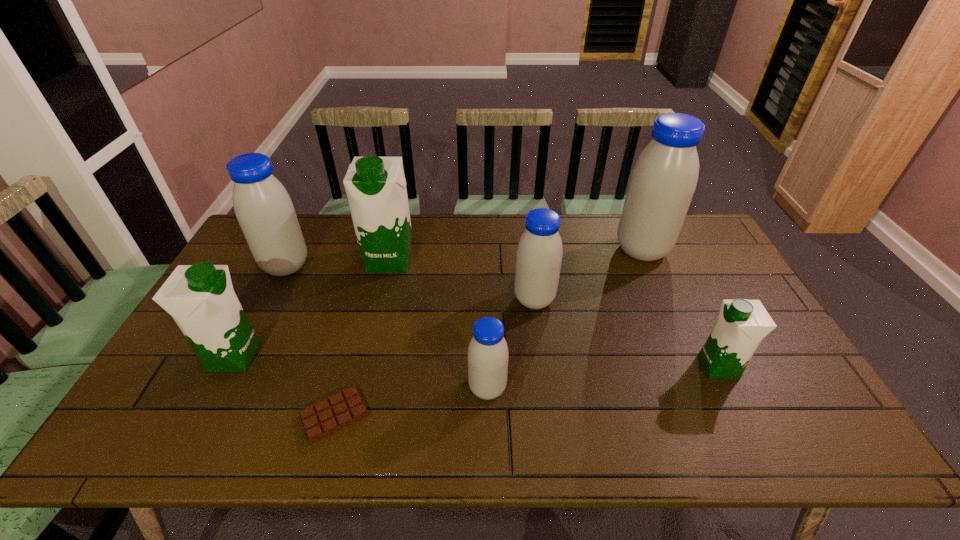
Choose which soya milk is the second nearest neighbor to the second green soya milk from left to right. Please provide its 2D coordinates. Your answer should be formatted as a tuple, i.e. [(x, y)], where the tuple contains the x and y coordinates of a point satisfying the conditions above.

[(200, 298)]

Select which soya milk appears as the third closest to the shortest object. Please provide its 2D coordinates. Your answer should be formatted as a tuple, i.e. [(x, y)], where the tuple contains the x and y coordinates of a point satisfying the conditions above.

[(263, 207)]

Locate which blue soya milk ranks third in proximity to the rightmost blue soya milk. Please provide its 2D coordinates. Your answer should be formatted as a tuple, i.e. [(x, y)], where the tuple contains the x and y coordinates of a point satisfying the conditions above.

[(263, 207)]

Select which blue soya milk is the third closest to the second smallest green soya milk. Please provide its 2D coordinates. Your answer should be formatted as a tuple, i.e. [(x, y)], where the tuple contains the x and y coordinates of a point satisfying the conditions above.

[(539, 254)]

Identify which green soya milk is the second closest to the fifth object from left to right. Please provide its 2D coordinates. Your answer should be formatted as a tuple, i.e. [(x, y)], where the tuple contains the x and y coordinates of a point satisfying the conditions above.

[(742, 324)]

Select which green soya milk appears as the closest to the rightmost green soya milk. Please provide its 2D coordinates. Your answer should be formatted as a tuple, i.e. [(x, y)], where the tuple contains the x and y coordinates of a point satisfying the conditions above.

[(375, 186)]

This screenshot has height=540, width=960. Identify the location of vacant point that satisfies the following two spatial constraints: 1. on the front-facing side of the second smallest blue soya milk; 2. on the right side of the farthest green soya milk. (380, 299).

This screenshot has width=960, height=540. What are the coordinates of `vacant position in the image that satisfies the following two spatial constraints: 1. on the front-facing side of the biggest green soya milk; 2. on the front-facing side of the leftmost green soya milk` in the screenshot? It's located at (367, 356).

I want to click on vacant area in the image that satisfies the following two spatial constraints: 1. on the front-facing side of the third soya milk from left to right; 2. on the front-facing side of the second biggest green soya milk, so click(x=367, y=356).